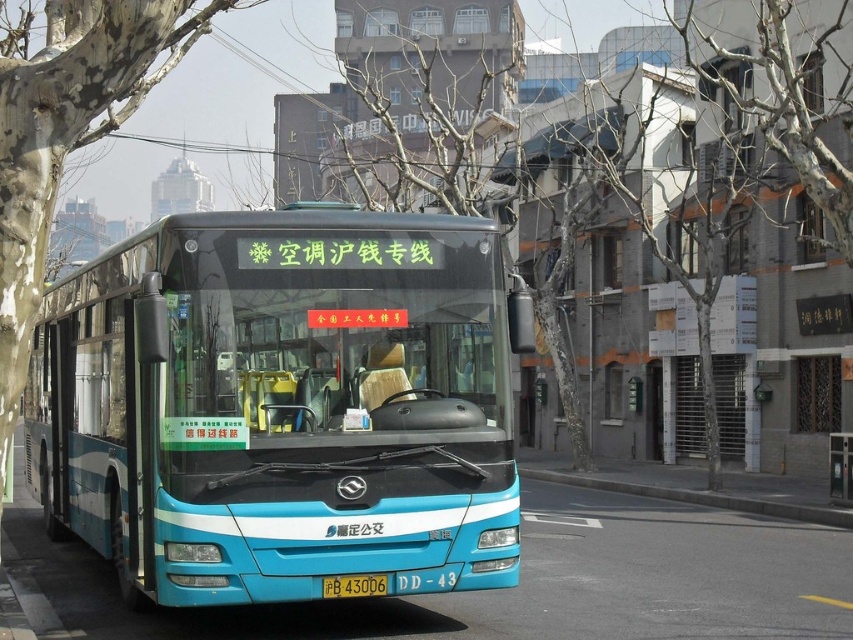
Is point (747, 460) closer to camera compared to point (672, 497)?

No, it is behind (672, 497).

Who is lower down, wooden signboard at right or gray concrete curb at lower center?

gray concrete curb at lower center is lower down.

Consider the image. Who is more forward, (734, 387) or (782, 516)?

Point (782, 516) is in front.

You are a GUI agent. You are given a task and a screenshot of the screen. Output one action in this format:
    pyautogui.click(x=<x>, y=<y>)
    Task: Click on the wooden signboard at right
    
    Given the screenshot: What is the action you would take?
    pyautogui.click(x=735, y=365)

Who is higher up, blue metallic bus at center or wooden signboard at right?

Positioned higher is blue metallic bus at center.

Which is below, blue metallic bus at center or wooden signboard at right?

Positioned lower is wooden signboard at right.

Is point (364, 538) positioned before point (751, 356)?

Yes, it is in front of point (751, 356).

Locate an element on the screen. Image resolution: width=853 pixels, height=640 pixels. blue metallic bus at center is located at coordinates (282, 404).

Is point (28, 156) more distant than point (366, 582)?

No, it is not.

Can you confirm if smooth bark tree at left is positioned to the left of yellow matte license plate at center?

Yes, smooth bark tree at left is to the left of yellow matte license plate at center.

Does point (177, 29) come farther from viewer compared to point (375, 579)?

Yes, point (177, 29) is farther from viewer.

Where is `smooth bark tree at left`? This screenshot has width=853, height=640. smooth bark tree at left is located at coordinates (67, 132).